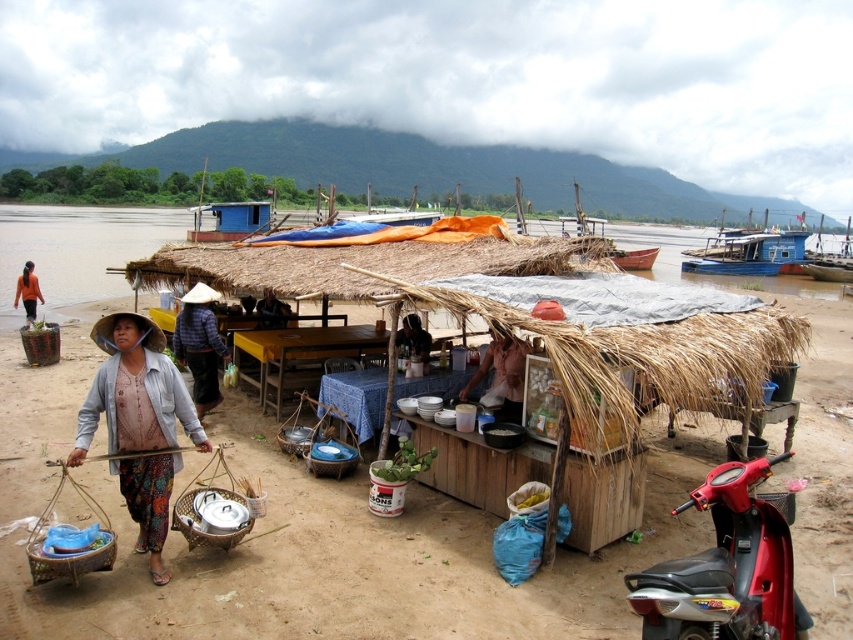
Question: Does shiny red motorcycle at lower right have a larger size compared to orange fabric at lower left?

Choices:
 (A) no
 (B) yes

Answer: (A)

Question: Estimate the real-world distances between objects in this image. Which object is closer to the matte black shirt at center?

Choices:
 (A) dark blue fabric at center
 (B) plaid fabric shirt at center
 (C) printed cotton skirt at lower left

Answer: (B)

Question: Is shiny red motorcycle at lower right behind light pink fabric at center?

Choices:
 (A) yes
 (B) no

Answer: (B)

Question: Which point is farther to the camera?

Choices:
 (A) brown thatch hut at center
 (B) orange fabric at lower left

Answer: (B)

Question: Which of the following is the farthest from the observer?

Choices:
 (A) plaid fabric shirt at center
 (B) dark blue fabric at center
 (C) matte black shirt at center
 (D) printed cotton skirt at lower left

Answer: (B)

Question: Is printed cotton skirt at lower left bigger than plaid fabric shirt at center?

Choices:
 (A) no
 (B) yes

Answer: (A)